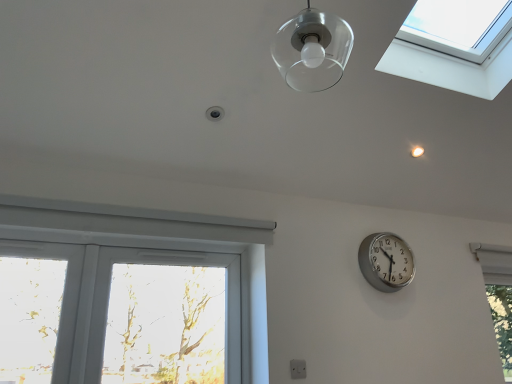
Locate an element on the screen. white plastic window at lower left is located at coordinates (165, 325).

Where is `droplight that appears in front of the white plastic electric outlet at lower center`? droplight that appears in front of the white plastic electric outlet at lower center is located at coordinates (215, 113).

Is transparent glass droplight at upper center far from white plastic electric outlet at lower center?

Indeed, transparent glass droplight at upper center is not near white plastic electric outlet at lower center.

From a real-world perspective, is transparent glass droplight at upper center physically located above or below white plastic electric outlet at lower center?

From a real-world perspective, transparent glass droplight at upper center is physically above white plastic electric outlet at lower center.

Is transparent glass droplight at upper center turned away from white plastic electric outlet at lower center?

transparent glass droplight at upper center is not turned away from white plastic electric outlet at lower center.

Considering the sizes of white plastic window at lower left and clear glass lampshade at upper center in the image, is white plastic window at lower left bigger or smaller than clear glass lampshade at upper center?

In the image, white plastic window at lower left appears to be larger than clear glass lampshade at upper center.

Would you say white plastic window at lower left is inside or outside clear glass lampshade at upper center?

white plastic window at lower left is outside clear glass lampshade at upper center.

Looking at this image, from the image's perspective, which is above, white plastic window at lower left or clear glass lampshade at upper center?

clear glass lampshade at upper center.

From a real-world perspective, is white plastic window at lower left physically above clear glass lampshade at upper center?

Incorrect, from a real-world perspective, white plastic window at lower left is lower than clear glass lampshade at upper center.

Can you confirm if silver metallic clock at right is positioned to the left of white plastic electric outlet at lower center?

In fact, silver metallic clock at right is to the right of white plastic electric outlet at lower center.

Between silver metallic clock at right and white plastic electric outlet at lower center, which one has less height?

white plastic electric outlet at lower center.

Which of these two, silver metallic clock at right or white plastic electric outlet at lower center, is bigger?

silver metallic clock at right.

How many degrees apart are the facing directions of silver metallic clock at right and white plastic electric outlet at lower center?

They differ by 0.635 degrees in their facing directions.

Is transparent glass droplight at upper center next to clear glass lampshade at upper center?

There is a gap between transparent glass droplight at upper center and clear glass lampshade at upper center.

From a real-world perspective, which object stands above the other?

transparent glass droplight at upper center.

Visually, is transparent glass droplight at upper center positioned to the left or to the right of clear glass lampshade at upper center?

From the image, it's evident that transparent glass droplight at upper center is to the left of clear glass lampshade at upper center.

Is transparent glass droplight at upper center further to camera compared to clear glass lampshade at upper center?

Yes.

Is white plastic electric outlet at lower center not close to transparent glass window at upper right, which is the 2th window in bottom-to-top order?

white plastic electric outlet at lower center is positioned a significant distance from transparent glass window at upper right, which is the 2th window in bottom-to-top order.

Is point (298, 376) more distant than point (449, 5)?

No, (298, 376) is closer to viewer.

How many degrees apart are the facing directions of white plastic electric outlet at lower center and transparent glass window at upper right, the 2th window when ordered from right to left?

The facing directions of white plastic electric outlet at lower center and transparent glass window at upper right, the 2th window when ordered from right to left, are 90.2 degrees apart.

Is white plastic electric outlet at lower center to the right of transparent glass window at upper right, the 1th window positioned from the left, from the viewer's perspective?

No.

Between point (213, 111) and point (119, 264), which one is positioned in front?

The point (213, 111) is in front.

From the image's perspective, is transparent glass droplight at upper center above or below white plastic window at lower left?

transparent glass droplight at upper center is above white plastic window at lower left.

Is transparent glass droplight at upper center positioned before white plastic window at lower left?

Yes, transparent glass droplight at upper center is closer to the viewer.

Does transparent glass droplight at upper center touch transparent glass window at lower right, which is the 1th window in back-to-front order?

No, transparent glass droplight at upper center is not beside transparent glass window at lower right, which is the 1th window in back-to-front order.

Does transparent glass droplight at upper center lie behind transparent glass window at lower right, positioned as the first window in right-to-left order?

No, it is in front of transparent glass window at lower right, positioned as the first window in right-to-left order.

Does transparent glass droplight at upper center have a lesser height compared to transparent glass window at lower right, which is the 1th window in back-to-front order?

Yes, transparent glass droplight at upper center is shorter than transparent glass window at lower right, which is the 1th window in back-to-front order.

Consider the image. What's the angular difference between transparent glass droplight at upper center and transparent glass window at lower right, which is the 1th window in back-to-front order,'s facing directions?

There is a 0.103-degree angle between the facing directions of transparent glass droplight at upper center and transparent glass window at lower right, which is the 1th window in back-to-front order.

Locate an element on the screen. droplight above the white plastic electric outlet at lower center (from the image's perspective) is located at coordinates (215, 113).

This screenshot has height=384, width=512. I want to click on lamp above the white plastic window at lower left (from a real-world perspective), so click(312, 50).

Based on their spatial positions, is white plastic window at lower left or clear glass lampshade at upper center closer to transparent glass window at lower right, which is the 1th window in back-to-front order?

white plastic window at lower left is positioned closer to the anchor transparent glass window at lower right, which is the 1th window in back-to-front order.

When comparing their distances from transparent glass window at upper right, placed as the second window when sorted from back to front, does white plastic window at lower left or transparent glass droplight at upper center seem closer?

transparent glass droplight at upper center.

Which object lies further to the anchor point silver metallic clock at right, transparent glass droplight at upper center or transparent glass window at lower right, which is the second window in left-to-right order?

transparent glass droplight at upper center.

Estimate the real-world distances between objects in this image. Which object is further from silver metallic clock at right, clear glass lampshade at upper center or transparent glass droplight at upper center?

transparent glass droplight at upper center is further to silver metallic clock at right.

In the scene shown: When comparing their distances from silver metallic clock at right, does white plastic window at lower left or white plastic electric outlet at lower center seem further?

white plastic window at lower left is positioned further to the anchor silver metallic clock at right.

Based on the photo, which object lies further to the anchor point transparent glass droplight at upper center, white plastic window at lower left or transparent glass window at lower right, positioned as the first window in right-to-left order?

transparent glass window at lower right, positioned as the first window in right-to-left order, lies further to transparent glass droplight at upper center than the other object.

Based on the photo, which object lies further to the anchor point transparent glass window at lower right, the second window from the top, clear glass lampshade at upper center or silver metallic clock at right?

The object further to transparent glass window at lower right, the second window from the top, is clear glass lampshade at upper center.

Which object lies nearer to the anchor point transparent glass window at upper right, which is counted as the 1th window, starting from the top, white plastic electric outlet at lower center or transparent glass droplight at upper center?

Based on the image, transparent glass droplight at upper center appears to be nearer to transparent glass window at upper right, which is counted as the 1th window, starting from the top.

Where is `droplight situated between white plastic window at lower left and transparent glass window at lower right, positioned as the first window in right-to-left order, from left to right`? droplight situated between white plastic window at lower left and transparent glass window at lower right, positioned as the first window in right-to-left order, from left to right is located at coordinates (215, 113).

Image resolution: width=512 pixels, height=384 pixels. I want to click on window between white plastic window at lower left and transparent glass window at lower right, which is the 1th window in back-to-front order, in the horizontal direction, so click(455, 46).

Locate an element on the screen. The height and width of the screenshot is (384, 512). lamp situated between transparent glass droplight at upper center and transparent glass window at upper right, which is counted as the 1th window, starting from the top, from left to right is located at coordinates (312, 50).

The image size is (512, 384). What are the coordinates of `lamp between transparent glass window at upper right, the 2th window when ordered from right to left, and white plastic window at lower left from top to bottom` in the screenshot? It's located at (312, 50).